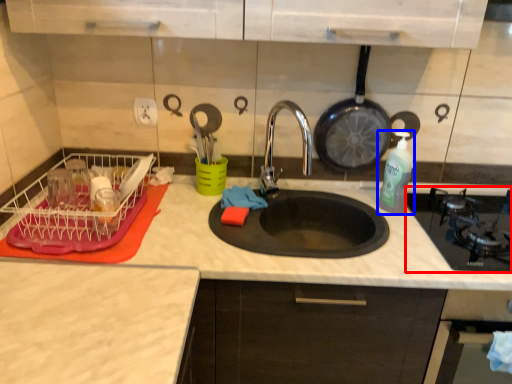
Question: Which point is further to the camera, gas stove (highlighted by a red box) or bottle (highlighted by a blue box)?

Choices:
 (A) gas stove
 (B) bottle

Answer: (B)